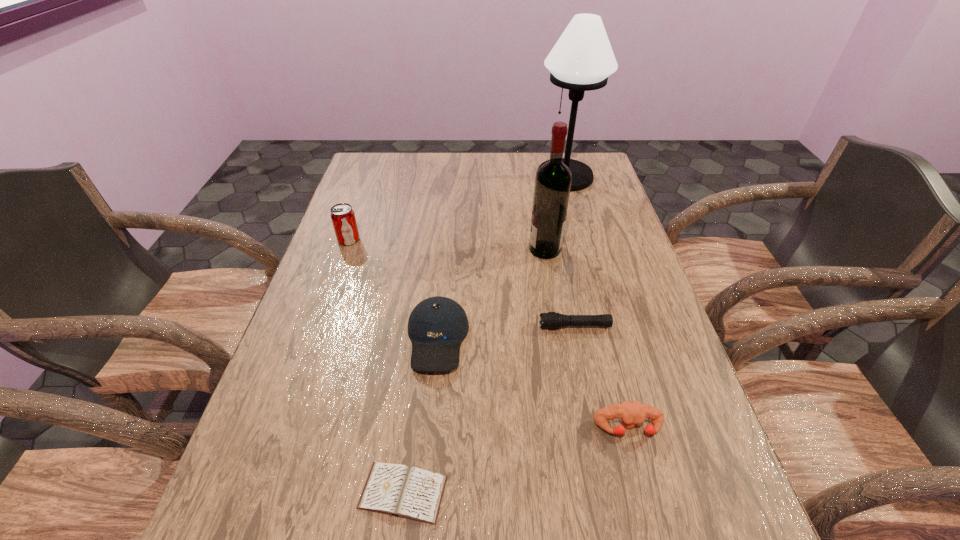
Locate an element on the screen. The height and width of the screenshot is (540, 960). the nearest object is located at coordinates (398, 490).

Where is `free space located on the front of the table lamp`? This screenshot has height=540, width=960. free space located on the front of the table lamp is located at coordinates (585, 249).

Where is `vacant region located 0.120m on the front and back of the second tallest object`? The height and width of the screenshot is (540, 960). vacant region located 0.120m on the front and back of the second tallest object is located at coordinates (486, 249).

Where is `vacant space situated on the front and back of the second tallest object`? This screenshot has width=960, height=540. vacant space situated on the front and back of the second tallest object is located at coordinates (461, 249).

Image resolution: width=960 pixels, height=540 pixels. In order to click on vacant area located on the front and back of the second tallest object in this screenshot , I will do `click(461, 249)`.

Locate an element on the screen. This screenshot has width=960, height=540. free region located on the right of the pop soda is located at coordinates (485, 240).

You are a GUI agent. You are given a task and a screenshot of the screen. Output one action in this format:
    pyautogui.click(x=<x>, y=<y>)
    Task: Click on the free region located on the front-facing side of the baseball cap
    Image resolution: width=960 pixels, height=540 pixels.
    Given the screenshot: What is the action you would take?
    pyautogui.click(x=425, y=469)

I want to click on blank space located 0.070m with the gloves of the sixth farthest object facing forward, so click(642, 480).

You are a GUI agent. You are given a task and a screenshot of the screen. Output one action in this format:
    pyautogui.click(x=<x>, y=<y>)
    Task: Click on the free spot located 0.370m at the lens end of the flashlight
    This screenshot has height=540, width=960.
    Given the screenshot: What is the action you would take?
    pyautogui.click(x=381, y=326)

This screenshot has width=960, height=540. Identify the location of vacant area situated at the lens end of the flashlight. (454, 326).